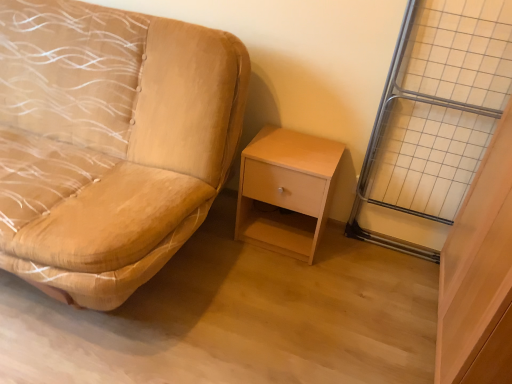
Locate an element on the screen. vacant space positioned to the left of light wood/finely finished nightstand at center-right is located at coordinates [213, 243].